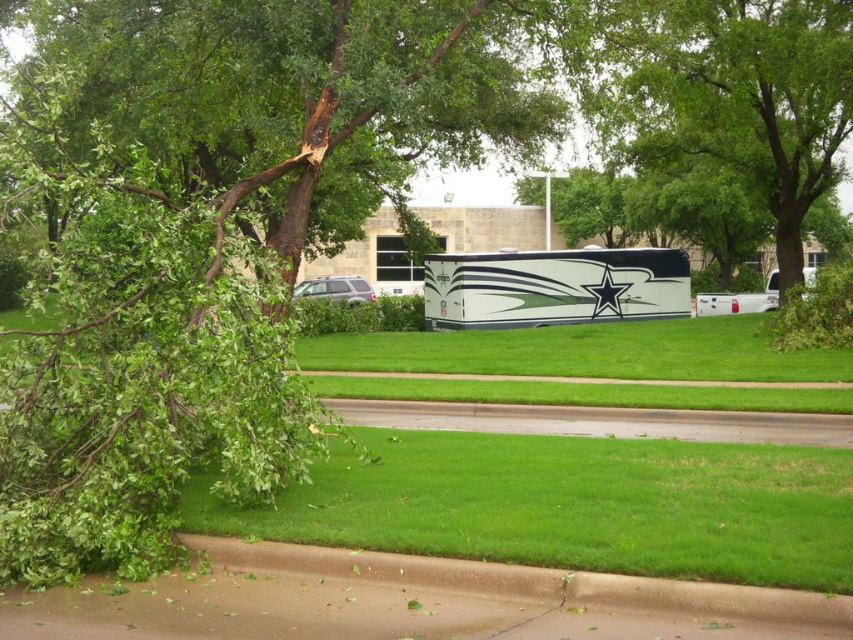
You are a delivery driver who needs to park your white glossy truck at center in a spot that is not on the green grass at center. Based on the scene, is there a suitable parking area available?

The green grass at center is to the left of the white glossy truck at center, so the truck can be parked to the right of the green grass at center to avoid parking on the grass.

You are a delivery person who needs to park your 20 feet long truck in the suburban area shown. The white glossy truck at center is already parked. Can you park your truck on the green grass at center without overlapping the truck? Explain your reasoning.

The distance between the green grass at center and the white glossy truck at center is 31.54 feet. Since your truck is 20 feet long, there is enough space to park it on the green grass at center without overlapping the truck as 31.54 feet is greater than 20 feet.